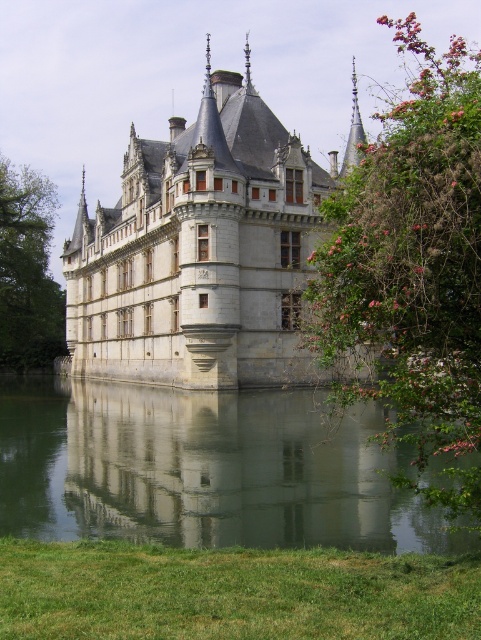
Question: Among these objects, which one is farthest from the camera?

Choices:
 (A) transparent glass water at lower center
 (B) gray stone castle at center

Answer: (B)

Question: Is gray stone castle at center positioned behind transparent glass water at lower center?

Choices:
 (A) no
 (B) yes

Answer: (B)

Question: In this image, where is gray stone castle at center located relative to transparent glass water at lower center?

Choices:
 (A) left
 (B) right

Answer: (B)

Question: Considering the relative positions of gray stone castle at center and transparent glass water at lower center in the image provided, where is gray stone castle at center located with respect to transparent glass water at lower center?

Choices:
 (A) above
 (B) below

Answer: (A)